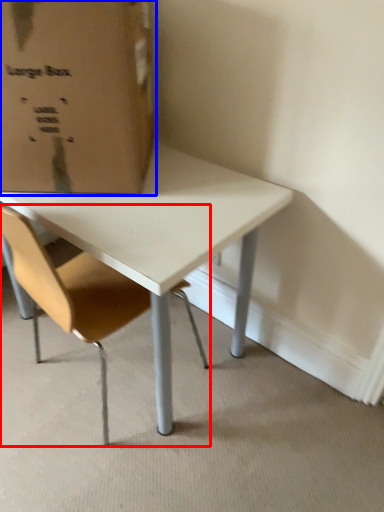
Question: Which object appears farthest to the camera in this image, chair (highlighted by a red box) or cardboard box (highlighted by a blue box)?

Choices:
 (A) chair
 (B) cardboard box

Answer: (B)